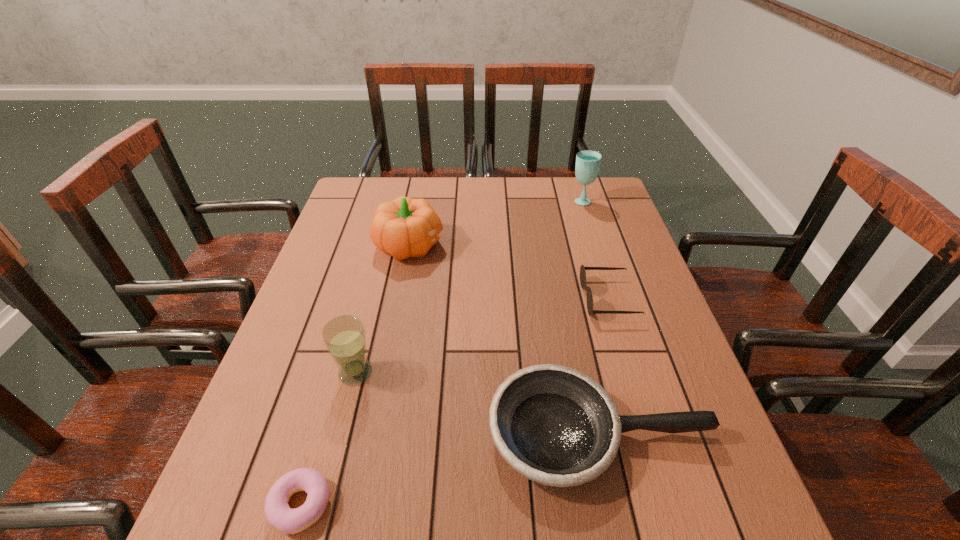
Image resolution: width=960 pixels, height=540 pixels. Find the location of `the farthest object`. the farthest object is located at coordinates (588, 162).

Find the location of a particular element. The height and width of the screenshot is (540, 960). the farther glass is located at coordinates (588, 162).

At what (x,y) coordinates should I click in order to perform the action: click on pumpkin. Please return your answer as a coordinate pair (x, y). The width and height of the screenshot is (960, 540). Looking at the image, I should click on (405, 227).

Where is `the shorter glass`? the shorter glass is located at coordinates (344, 336).

Where is `the nearer glass`? the nearer glass is located at coordinates (344, 336).

Find the location of a particular element. This screenshot has height=540, width=960. sunglasses is located at coordinates (583, 284).

Locate an element on the screen. frying pan is located at coordinates [x=554, y=425].

I want to click on doughnut, so click(278, 513).

You are a GUI agent. You are given a task and a screenshot of the screen. Output one action in this format:
    pyautogui.click(x=<x>, y=<y>)
    Task: Click on the free space located 0.180m on the front of the right glass
    Image resolution: width=960 pixels, height=540 pixels.
    Given the screenshot: What is the action you would take?
    pyautogui.click(x=593, y=240)

Find the location of a particular element. The height and width of the screenshot is (540, 960). blank space located 0.270m on the carved face of the pumpkin is located at coordinates (537, 245).